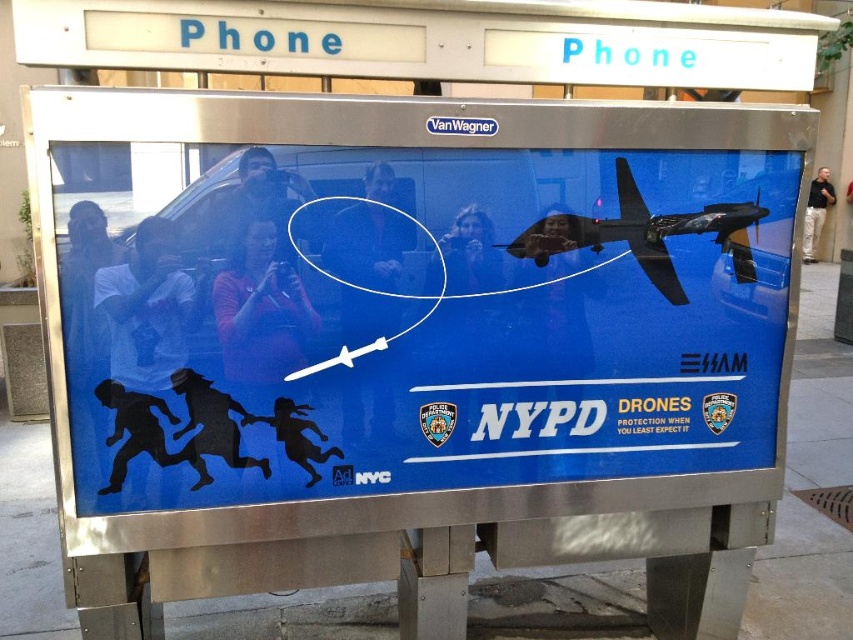
You are a photographer standing 2 meters away from the blue matte airplane at center. You want to take a photo of it with your camera. Considering the distance between you and the airplane, can you successfully capture the entire airplane in your shot without moving closer?

The blue matte airplane at center and camera are 1.89 meters apart from each other. Since you are standing 2 meters away, the total distance between you and the airplane is 3.89 meters. However, the question states the distance between the airplane and the camera is 1.89 meters. This suggests that the camera is already positioned 1.89 meters away from the airplane. Therefore, if you are 2 meters behind the camera, the total distance would be 3.89 meters. Whether you can capture the entire airplane depends o

You are a photographer standing in front of the phone booth. You want to capture both the blue matte airplane at center and the shiny black drone at upper right in the same frame. Which object should you focus on first to ensure both are in the frame?

You should focus on the blue matte airplane at center first because it is larger than the shiny black drone at upper right, ensuring it fits within the frame while the smaller drone remains visible.